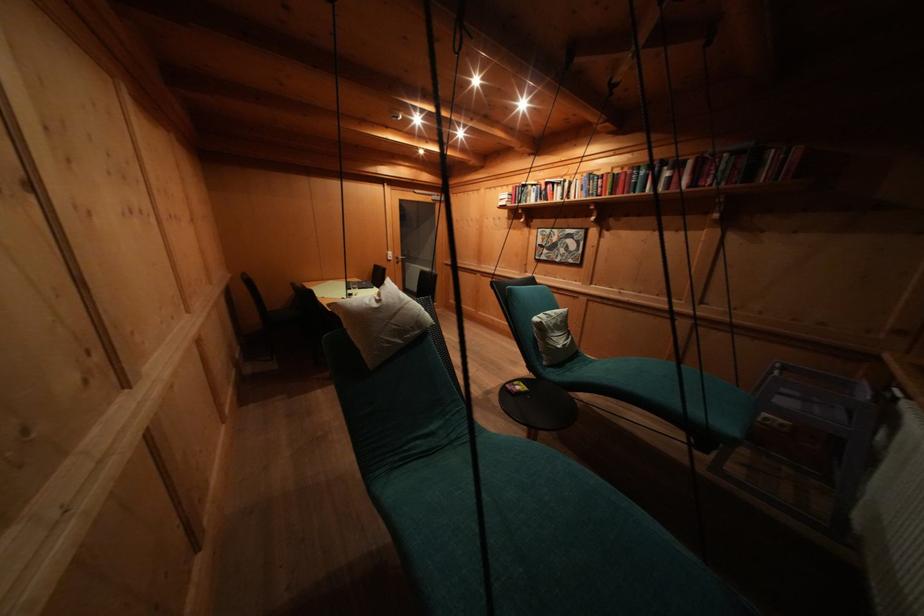
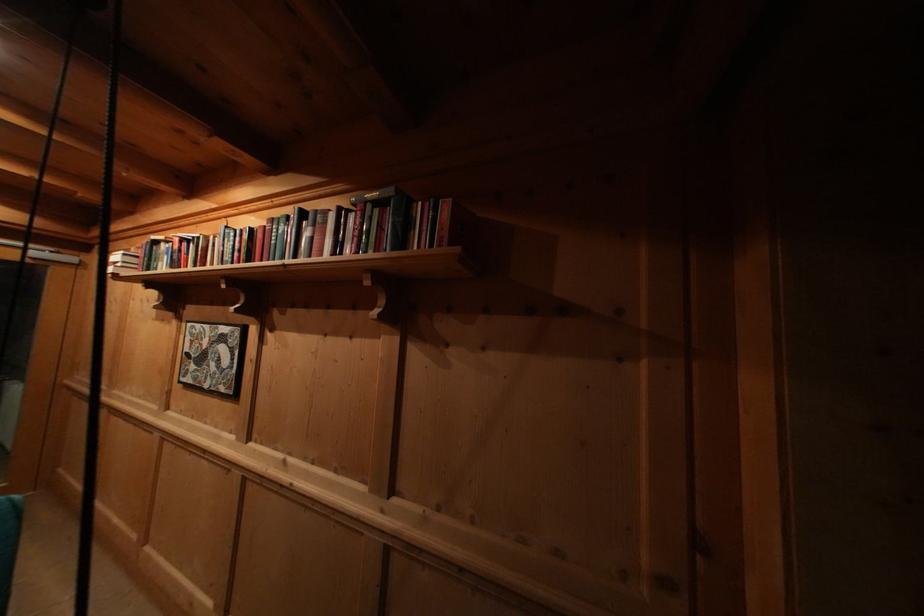
Locate, in the second image, the point that corresponds to (606,185) in the first image.

(244, 245)